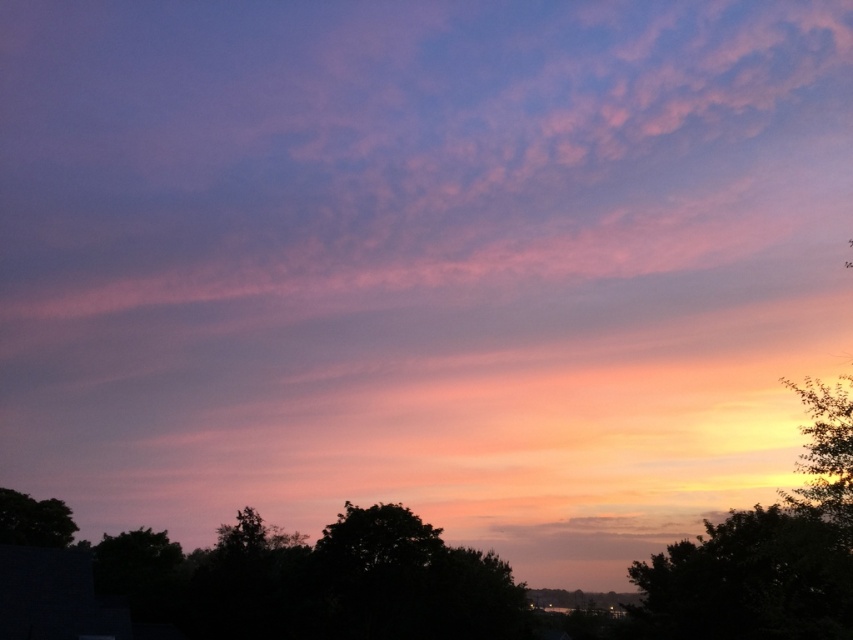
Question: Which of the following is the closest to the observer?

Choices:
 (A) green leafy tree at lower right
 (B) green leafy tree at lower left

Answer: (A)

Question: Is green leafy tree at lower right bigger than green leafy tree at lower left?

Choices:
 (A) yes
 (B) no

Answer: (A)

Question: Is green leafy tree at right thinner than green leafy tree at lower left?

Choices:
 (A) yes
 (B) no

Answer: (B)

Question: Which object is the farthest from the green leafy tree at lower right?

Choices:
 (A) green leafy tree at right
 (B) green leafy tree at lower left

Answer: (B)

Question: Can you confirm if green leafy tree at right is positioned above green leafy tree at lower left?

Choices:
 (A) no
 (B) yes

Answer: (B)

Question: Which of the following is the farthest from the observer?

Choices:
 (A) green leafy tree at lower left
 (B) green leafy tree at right

Answer: (A)